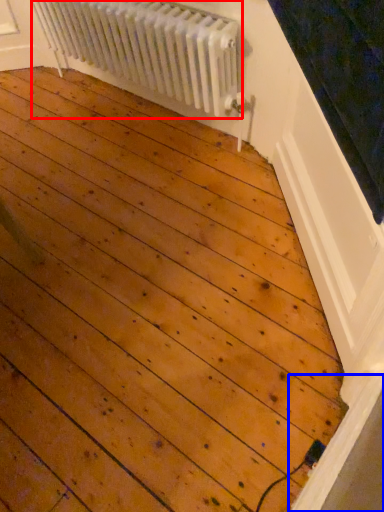
Question: Which point is closer to the camera, radiator (highlighted by a red box) or window sill (highlighted by a blue box)?

Choices:
 (A) radiator
 (B) window sill

Answer: (B)